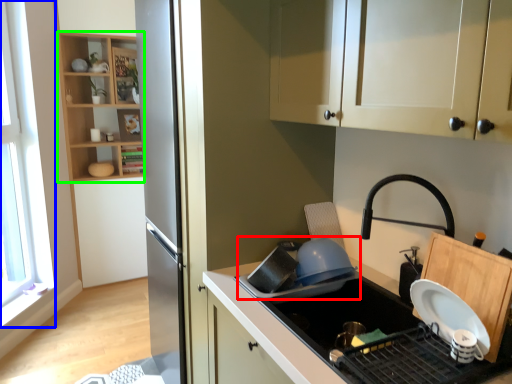
Question: Estimate the real-world distances between objects in this image. Which object is closer to appliance (highlighted by a red box), window (highlighted by a blue box) or shelf (highlighted by a green box)?

Choices:
 (A) window
 (B) shelf

Answer: (A)